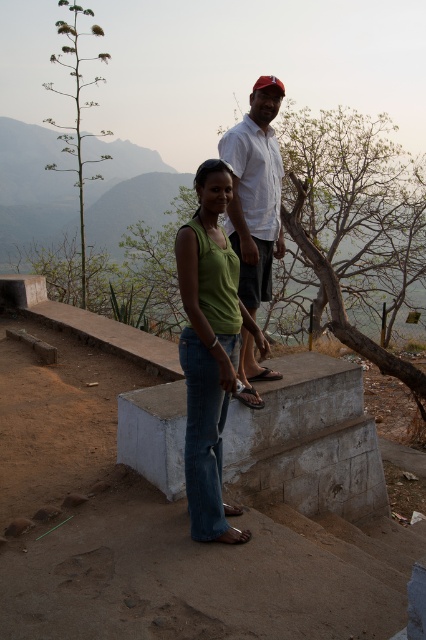
Question: Is green matte tank top at center to the left of white cotton shirt at upper center from the viewer's perspective?

Choices:
 (A) yes
 (B) no

Answer: (A)

Question: Does green matte tank top at center have a smaller size compared to white cotton shirt at upper center?

Choices:
 (A) yes
 (B) no

Answer: (A)

Question: Is green matte tank top at center above white cotton shirt at upper center?

Choices:
 (A) no
 (B) yes

Answer: (A)

Question: Which point is farther to the camera?

Choices:
 (A) (258, 237)
 (B) (203, 358)

Answer: (A)

Question: Which object is closer to the camera taking this photo?

Choices:
 (A) white cotton shirt at upper center
 (B) green matte tank top at center

Answer: (B)